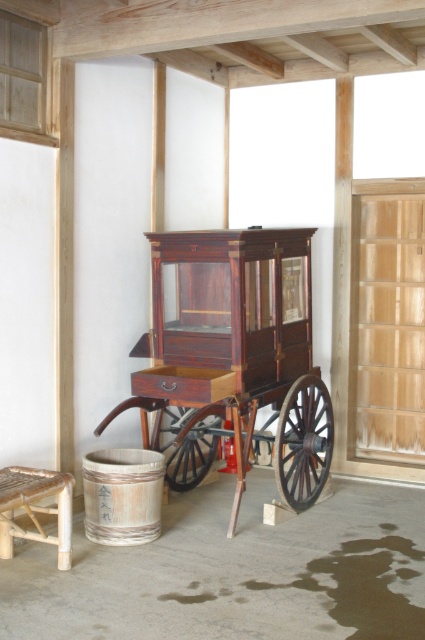
You are standing in the room and want to place a new decorative item on the floor. The mahogany wood wagon at center is currently occupying space at point coordinates. Can you place your item near the wagon without being directly under it?

The mahogany wood wagon at center is located at point coordinates, so you can place your decorative item near it but not directly underneath by positioning it at a different coordinate that is not overlapping with the wagon.

You are standing in the room and want to move from the bamboo stool at lower left to the mahogany wood wagon at center. Which direction should you move to reach the wagon?

The mahogany wood wagon at center is positioned on the right side of the bamboo stool at lower left, so you should move to your right to reach the wagon.